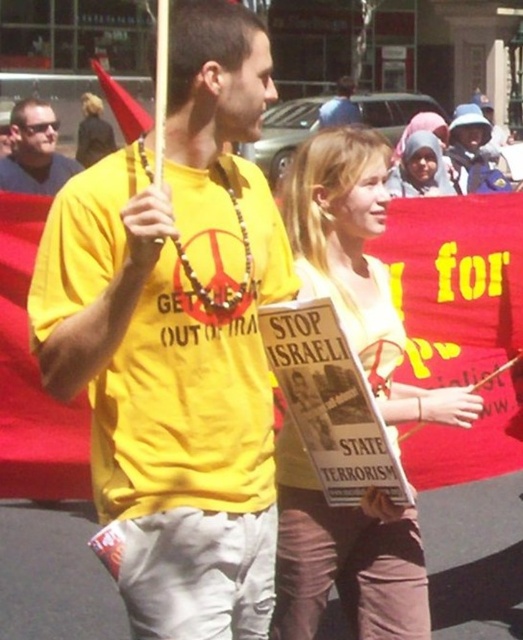
Which is more to the left, yellow matte shirt at center or matte yellow t-shirt at center?

Positioned to the left is yellow matte shirt at center.

You are a GUI agent. You are given a task and a screenshot of the screen. Output one action in this format:
    pyautogui.click(x=<x>, y=<y>)
    Task: Click on the yellow matte shirt at center
    This screenshot has height=640, width=523.
    Given the screenshot: What is the action you would take?
    pyautogui.click(x=176, y=339)

The width and height of the screenshot is (523, 640). What do you see at coordinates (176, 339) in the screenshot?
I see `yellow matte shirt at center` at bounding box center [176, 339].

What are the coordinates of `yellow matte shirt at center` in the screenshot? It's located at pos(176,339).

Based on the photo, between smooth cardboard sign at center and matte black sunglasses at upper left, which one appears on the right side from the viewer's perspective?

smooth cardboard sign at center

Image resolution: width=523 pixels, height=640 pixels. What do you see at coordinates (358, 266) in the screenshot?
I see `smooth cardboard sign at center` at bounding box center [358, 266].

Which is in front, point (395, 337) or point (32, 156)?

Point (395, 337) is in front.

Where is `smooth cardboard sign at center`? The width and height of the screenshot is (523, 640). smooth cardboard sign at center is located at coordinates (358, 266).

Is matte black sunglasses at upper left closer to camera compared to matte pink hijab at upper center?

That is True.

Who is positioned more to the right, matte black sunglasses at upper left or matte pink hijab at upper center?

From the viewer's perspective, matte pink hijab at upper center appears more on the right side.

Which is behind, point (32, 176) or point (426, 163)?

The point (426, 163) is more distant.

Find the location of a particular element. This screenshot has height=640, width=523. matte black sunglasses at upper left is located at coordinates (35, 150).